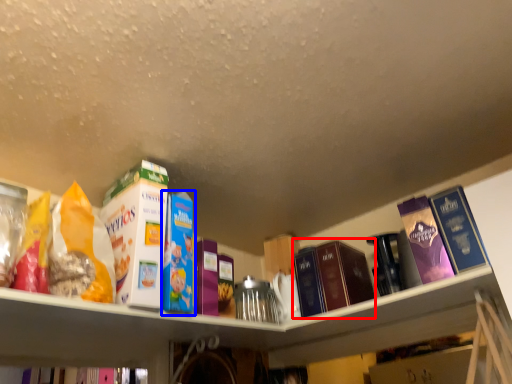
Question: Which object appears closest to the camera in this image, book (highlighted by a red box) or book (highlighted by a blue box)?

Choices:
 (A) book
 (B) book

Answer: (B)